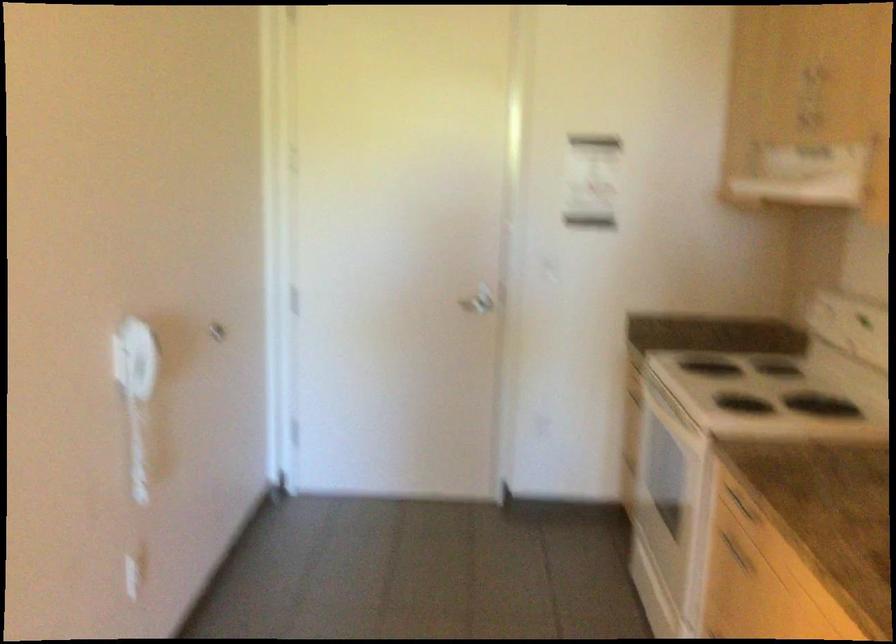
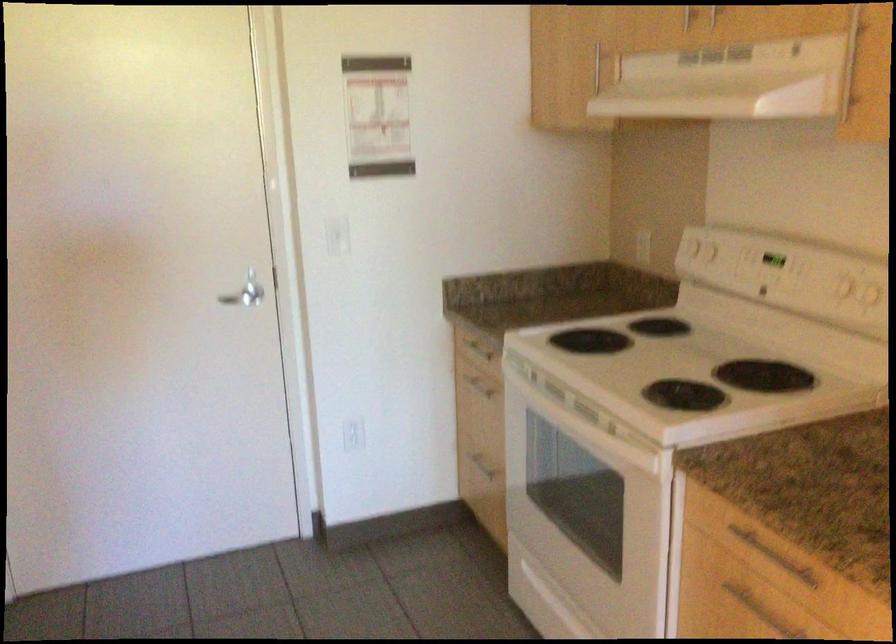
In the second image, find the point that corresponds to point 630,462 in the first image.

(478, 462)